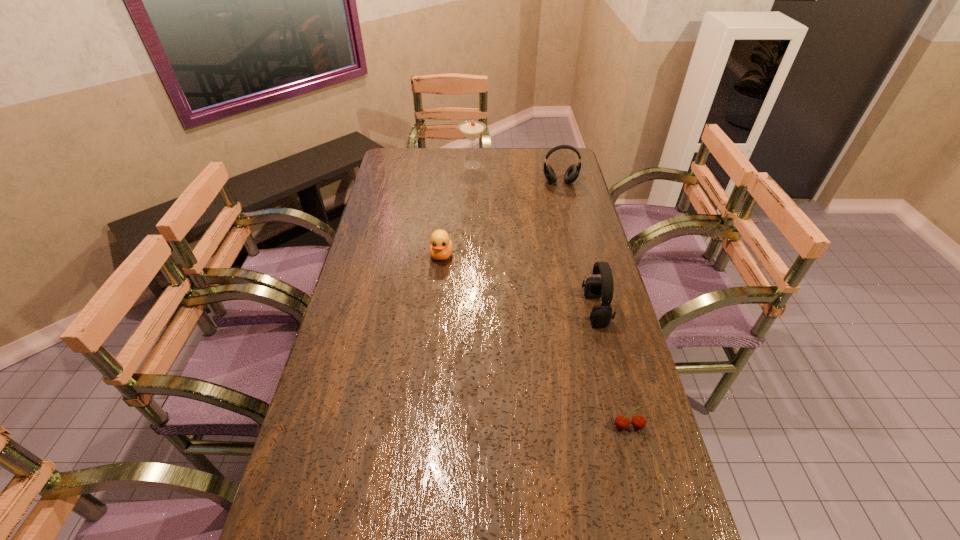
Where is `vacant space located on the headband of the second nearest object`? vacant space located on the headband of the second nearest object is located at coordinates (461, 309).

You are a GUI agent. You are given a task and a screenshot of the screen. Output one action in this format:
    pyautogui.click(x=<x>, y=<y>)
    Task: Click on the vacant region located on the headband of the second nearest object
    This screenshot has width=960, height=540.
    Given the screenshot: What is the action you would take?
    pyautogui.click(x=454, y=309)

Where is `free space located on the ear cups of the farther headset`? This screenshot has height=540, width=960. free space located on the ear cups of the farther headset is located at coordinates (569, 222).

Find the location of `vacant space situated on the face of the duckling`. vacant space situated on the face of the duckling is located at coordinates (438, 292).

Where is `free location located on the surface of the cherry`? The height and width of the screenshot is (540, 960). free location located on the surface of the cherry is located at coordinates (650, 510).

You are a GUI agent. You are given a task and a screenshot of the screen. Output one action in this format:
    pyautogui.click(x=<x>, y=<y>)
    Task: Click on the object positioned at the far edge
    The image size is (960, 540).
    Given the screenshot: What is the action you would take?
    pyautogui.click(x=471, y=129)

Find the location of a particular element. cherry that is at the right edge is located at coordinates (622, 422).

This screenshot has height=540, width=960. In the image, there is a desktop. Identify the location of vacant region at the far edge. (499, 157).

Find the location of a particular element. free space at the left edge of the desktop is located at coordinates (410, 227).

In the image, there is a desktop. At what (x,y) coordinates should I click in order to perform the action: click on blank space at the right edge. Please return your answer as a coordinate pair (x, y). Looking at the image, I should click on coord(620,407).